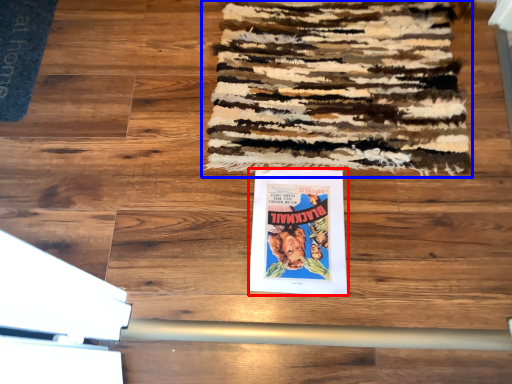
Question: Among these objects, which one is nearest to the camera, poster (highlighted by a red box) or mat (highlighted by a blue box)?

Choices:
 (A) poster
 (B) mat

Answer: (A)